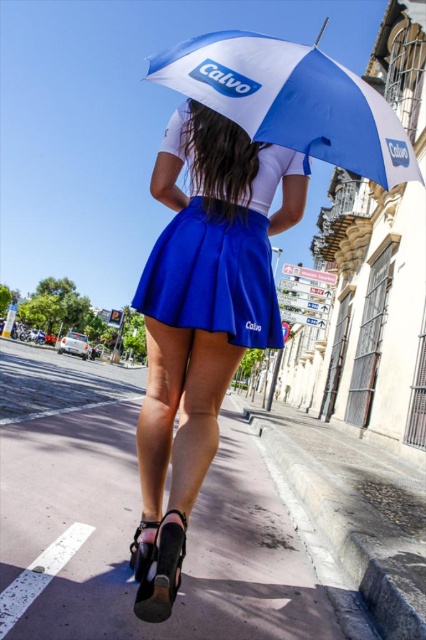
Which is in front, point (268, 221) or point (268, 294)?

Point (268, 294) is in front.

Who is taller, blue pleated skirt at center or blue satin skirt at center?

blue pleated skirt at center

What are the coordinates of `blue pleated skirt at center` in the screenshot? It's located at (201, 317).

Can you confirm if blue satin skirt at center is taller than white/blue fabric umbrella at upper center?

No, blue satin skirt at center is not taller than white/blue fabric umbrella at upper center.

Looking at this image, between blue satin skirt at center and white/blue fabric umbrella at upper center, which one has less height?

Standing shorter between the two is blue satin skirt at center.

You are a GUI agent. You are given a task and a screenshot of the screen. Output one action in this format:
    pyautogui.click(x=<x>, y=<y>)
    Task: Click on the blue satin skirt at center
    
    Given the screenshot: What is the action you would take?
    pyautogui.click(x=218, y=234)

Image resolution: width=426 pixels, height=640 pixels. What are the coordinates of `blue satin skirt at center` in the screenshot? It's located at (218, 234).

Which of these two, blue pleated skirt at center or white/blue fabric umbrella at upper center, stands shorter?

blue pleated skirt at center

Between point (259, 221) and point (324, 131), which one is positioned behind?

The point (259, 221) is behind.

Find the location of a particular element. blue pleated skirt at center is located at coordinates (201, 317).